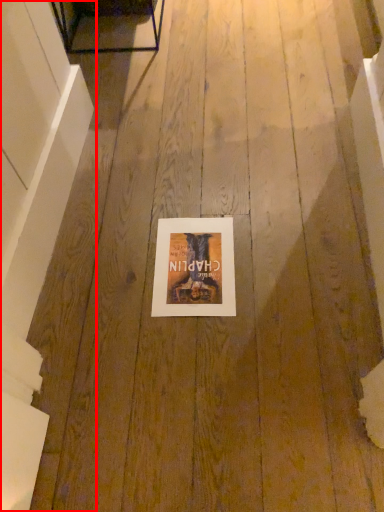
Question: Considering the relative positions of stairwell (annotated by the red box) and picture frame in the image provided, where is stairwell (annotated by the red box) located with respect to the staircase?

Choices:
 (A) left
 (B) right

Answer: (A)